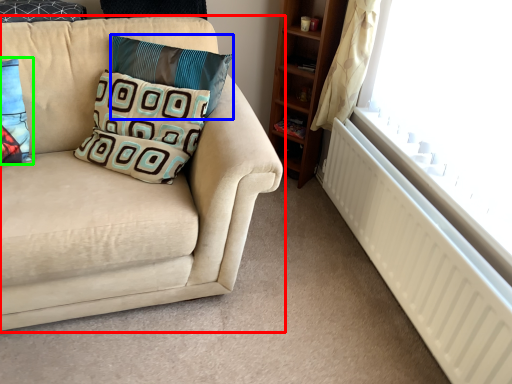
Question: Considering the real-world distances, which object is farthest from studio couch (highlighted by a red box)? pillow (highlighted by a blue box) or pillow (highlighted by a green box)?

Choices:
 (A) pillow
 (B) pillow

Answer: (B)